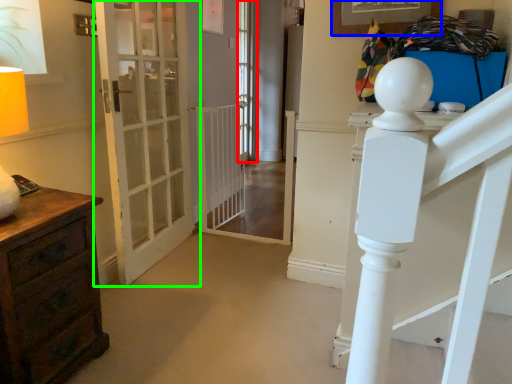
Question: Considering the real-world distances, which object is farthest from window (highlighted by a red box)? picture frame (highlighted by a blue box) or door (highlighted by a green box)?

Choices:
 (A) picture frame
 (B) door

Answer: (A)